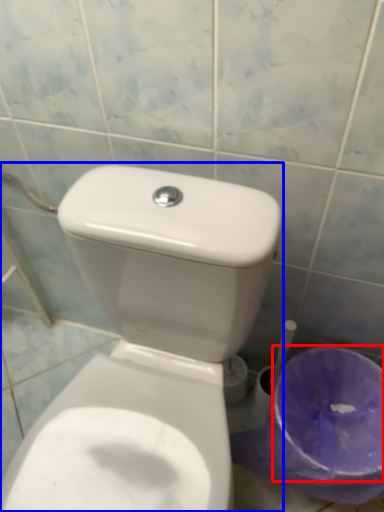
Question: Which point is further to the camera, potty (highlighted by a red box) or toilet (highlighted by a blue box)?

Choices:
 (A) potty
 (B) toilet

Answer: (A)